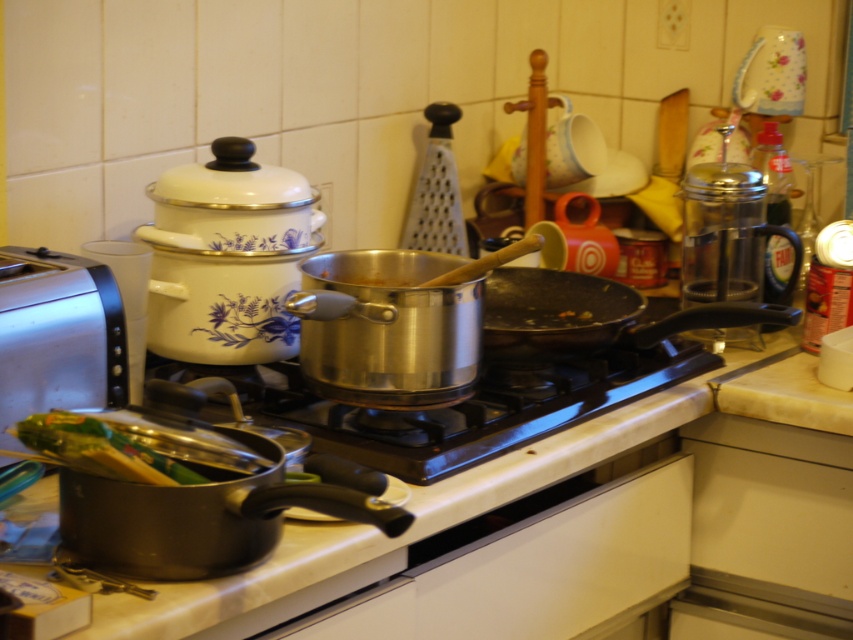
Between stainless steel gas stove at center and silver metallic toaster at left, which one has less height?

stainless steel gas stove at center

Can you confirm if stainless steel gas stove at center is positioned above silver metallic toaster at left?

Incorrect, stainless steel gas stove at center is not positioned above silver metallic toaster at left.

Is point (363, 410) positioned after point (3, 298)?

Yes, point (363, 410) is farther from viewer.

This screenshot has height=640, width=853. Identify the location of stainless steel gas stove at center. (457, 406).

Measure the distance from silver metallic toaster at left to non-stick black frying pan at center.

The distance of silver metallic toaster at left from non-stick black frying pan at center is 25.10 inches.

Is silver metallic toaster at left shorter than non-stick black frying pan at center?

In fact, silver metallic toaster at left may be taller than non-stick black frying pan at center.

Is point (0, 444) positioned in front of point (706, 314)?

Yes, it is.

The image size is (853, 640). What are the coordinates of `silver metallic toaster at left` in the screenshot? It's located at (57, 336).

Does stainless steel gas stove at center have a greater width compared to non-stick black frying pan at center?

Indeed, stainless steel gas stove at center has a greater width compared to non-stick black frying pan at center.

Is stainless steel gas stove at center below non-stick black frying pan at center?

Yes.

Is point (409, 442) closer to viewer compared to point (730, 305)?

Yes.

What are the coordinates of `stainless steel gas stove at center` in the screenshot? It's located at (457, 406).